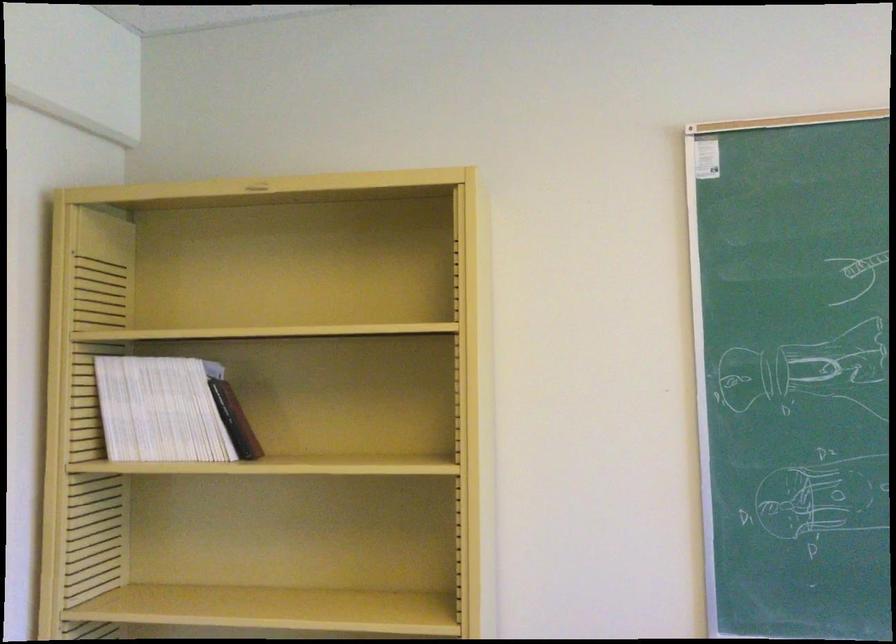
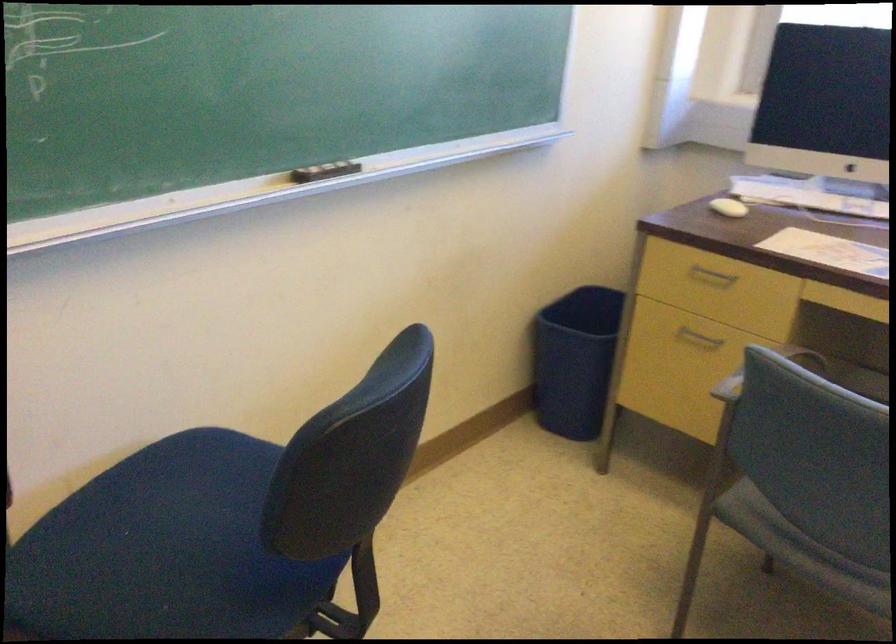
The first image is from the beginning of the video and the second image is from the end. How did the camera likely rotate when shooting the video?

The rotation direction of the camera is right-down.